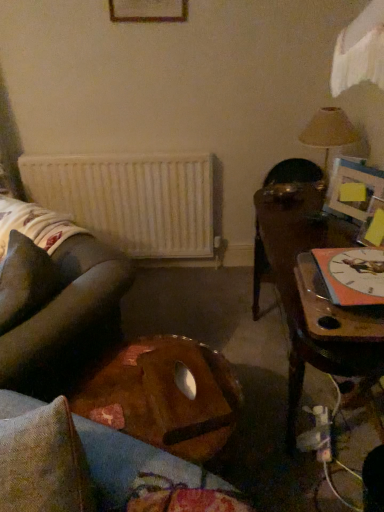
In the scene shown: What is the approximate height of brown fabric pillow at lower left?

11.12 inches.

What is the approximate height of wooden table at right, the first table in the right-to-left sequence?

It is 29.10 inches.

Where is `matte beige lampshade at upper right`? matte beige lampshade at upper right is located at coordinates (328, 132).

From their relative heights in the image, would you say white matte radiator at center is taller or shorter than wooden table at right, the first table in the right-to-left sequence?

In the image, white matte radiator at center appears to be taller than wooden table at right, the first table in the right-to-left sequence.

Are white matte radiator at center and wooden table at right, the first table in the right-to-left sequence, far apart?

That's not correct — white matte radiator at center is a little close to wooden table at right, the first table in the right-to-left sequence.

Where is `radiator above the wooden table at right, the 2th table viewed from the left (from a real-world perspective)`? radiator above the wooden table at right, the 2th table viewed from the left (from a real-world perspective) is located at coordinates (132, 200).

Considering the positions of point (154, 215) and point (375, 378), is point (154, 215) closer or farther from the camera than point (375, 378)?

Clearly, point (154, 215) is more distant from the camera than point (375, 378).

Is point (311, 135) positioned after point (301, 317)?

Yes.

Between matte beige lampshade at upper right and wooden table at right, the first table in the right-to-left sequence, which one is positioned behind?

matte beige lampshade at upper right is further away from the camera.

Is wooden table at right, the first table in the right-to-left sequence, a part of matte beige lampshade at upper right?

Actually, wooden table at right, the first table in the right-to-left sequence, is outside matte beige lampshade at upper right.

From a real-world perspective, which object rests below the other?

From a 3D spatial view, wooden table at right, the first table in the right-to-left sequence, is below.

This screenshot has height=512, width=384. Identify the location of picture frame on the left of matte beige lampshade at upper right. (148, 11).

Who is shorter, matte beige lampshade at upper right or wooden picture frame at upper center?

wooden picture frame at upper center.

Is point (321, 132) closer or farther from the camera than point (185, 20)?

Point (321, 132) appears to be closer to the viewer than point (185, 20).

Is the position of matte beige lampshade at upper right more distant than that of wooden picture frame at upper center?

No, matte beige lampshade at upper right is closer to the viewer.

Is point (38, 307) in front of point (202, 381)?

No, (38, 307) is behind (202, 381).

From a real-world perspective, which is physically above, brown fabric pillow at lower left or wooden tray at center, the second table viewed from the right?

In real-world perspective, brown fabric pillow at lower left is above.

At what (x,y) coordinates should I click in order to perform the action: click on table that is the 2nd object directly below the brown fabric pillow at lower left (from a real-world perspective). Please return your answer as a coordinate pair (x, y). Looking at the image, I should click on (164, 396).

Consider the image. Is brown fabric pillow at lower left directly adjacent to wooden tray at center, the second table viewed from the right?

No.

Considering the relative positions of wooden tray at center, the second table viewed from the right, and matte beige lampshade at upper right in the image provided, is wooden tray at center, the second table viewed from the right, behind matte beige lampshade at upper right?

No.

Can you confirm if wooden tray at center, arranged as the 1th table when viewed from the left, is wider than matte beige lampshade at upper right?

Indeed, wooden tray at center, arranged as the 1th table when viewed from the left, has a greater width compared to matte beige lampshade at upper right.

How different are the orientations of wooden picture frame at upper center and matte beige lampshade at upper right in degrees?

88.8 degrees.

At what (x,y) coordinates should I click in order to perform the action: click on picture frame lying behind the matte beige lampshade at upper right. Please return your answer as a coordinate pair (x, y). Looking at the image, I should click on (148, 11).

Based on the photo, is wooden picture frame at upper center spatially inside matte beige lampshade at upper right, or outside of it?

wooden picture frame at upper center is not inside matte beige lampshade at upper right, it's outside.

In terms of size, does brown fabric pillow at lower left appear bigger or smaller than white matte radiator at center?

In the image, brown fabric pillow at lower left appears to be smaller than white matte radiator at center.

Considering the relative sizes of brown fabric pillow at lower left and white matte radiator at center in the image provided, is brown fabric pillow at lower left taller than white matte radiator at center?

No, brown fabric pillow at lower left is not taller than white matte radiator at center.

Is brown fabric pillow at lower left in front of white matte radiator at center?

Yes, brown fabric pillow at lower left is in front of white matte radiator at center.

Which table is the 2nd one when counting from the front of the white matte radiator at center? Please provide its 2D coordinates.

[(299, 293)]

Image resolution: width=384 pixels, height=512 pixels. Identify the location of lamp above the wooden table at right, the first table in the right-to-left sequence (from the image's perspective). pyautogui.click(x=328, y=132).

Looking at the image, which one is located closer to wooden tray at center, the second table viewed from the right, wooden picture frame at upper center or white matte radiator at center?

Based on the image, white matte radiator at center appears to be nearer to wooden tray at center, the second table viewed from the right.

Estimate the real-world distances between objects in this image. Which object is closer to matte beige lampshade at upper right, wooden table at right, the 2th table viewed from the left, or white matte radiator at center?

The object closer to matte beige lampshade at upper right is wooden table at right, the 2th table viewed from the left.

Which object lies further to the anchor point brown fabric pillow at lower left, matte beige lampshade at upper right or white matte radiator at center?

Based on the image, matte beige lampshade at upper right appears to be further to brown fabric pillow at lower left.

Estimate the real-world distances between objects in this image. Which object is further from wooden picture frame at upper center, brown fabric pillow at lower left or wooden table at right, the first table in the right-to-left sequence?

brown fabric pillow at lower left is positioned further to the anchor wooden picture frame at upper center.

Considering their positions, is brown fabric pillow at lower left positioned further to wooden tray at center, the second table viewed from the right, than matte beige lampshade at upper right?

Among the two, matte beige lampshade at upper right is located further to wooden tray at center, the second table viewed from the right.

When comparing their distances from wooden table at right, the first table in the right-to-left sequence, does brown fabric pillow at lower left or matte beige lampshade at upper right seem further?

The object further to wooden table at right, the first table in the right-to-left sequence, is brown fabric pillow at lower left.

Which object lies further to the anchor point wooden tray at center, arranged as the 1th table when viewed from the left, wooden picture frame at upper center or matte beige lampshade at upper right?

Among the two, wooden picture frame at upper center is located further to wooden tray at center, arranged as the 1th table when viewed from the left.

Considering their positions, is white matte radiator at center positioned further to wooden tray at center, arranged as the 1th table when viewed from the left, than wooden table at right, the first table in the right-to-left sequence?

white matte radiator at center.

Where is `lamp positioned between wooden tray at center, arranged as the 1th table when viewed from the left, and white matte radiator at center from near to far`? lamp positioned between wooden tray at center, arranged as the 1th table when viewed from the left, and white matte radiator at center from near to far is located at coordinates click(328, 132).

At what (x,y) coordinates should I click in order to perform the action: click on lamp positioned between wooden table at right, the first table in the right-to-left sequence, and white matte radiator at center from near to far. Please return your answer as a coordinate pair (x, y). Looking at the image, I should click on (328, 132).

The image size is (384, 512). I want to click on lamp between wooden picture frame at upper center and brown fabric pillow at lower left from top to bottom, so click(x=328, y=132).

Find the location of a particular element. The image size is (384, 512). table between wooden table at right, the 2th table viewed from the left, and white matte radiator at center in the front-back direction is located at coordinates (164, 396).